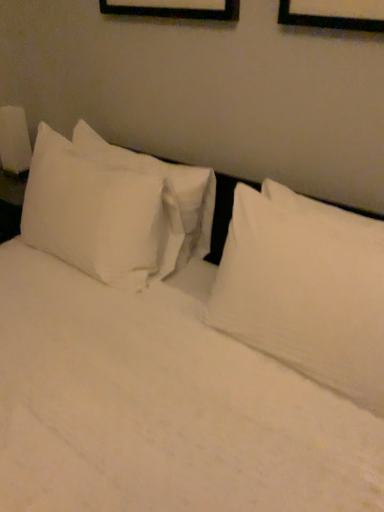
Where is `white soft pillow at upper right, which is the second pillow from left to right`? This screenshot has width=384, height=512. white soft pillow at upper right, which is the second pillow from left to right is located at coordinates (304, 295).

I want to click on white cotton pillow at left, placed as the second pillow when sorted from right to left, so click(x=100, y=215).

What do you see at coordinates (100, 215) in the screenshot?
I see `white cotton pillow at left, placed as the second pillow when sorted from right to left` at bounding box center [100, 215].

In order to click on white glossy lampshade at left in this screenshot , I will do `click(14, 140)`.

Considering the positions of objects white cotton pillow at left, which appears as the first pillow when viewed from the left, and white soft pillow at upper right, which is the second pillow from left to right, in the image provided, who is more to the left, white cotton pillow at left, which appears as the first pillow when viewed from the left, or white soft pillow at upper right, which is the second pillow from left to right,?

From the viewer's perspective, white cotton pillow at left, which appears as the first pillow when viewed from the left, appears more on the left side.

Can you confirm if white cotton pillow at left, which appears as the first pillow when viewed from the left, is bigger than white soft pillow at upper right, the 1th pillow positioned from the right?

Correct, white cotton pillow at left, which appears as the first pillow when viewed from the left, is larger in size than white soft pillow at upper right, the 1th pillow positioned from the right.

Considering the relative positions of white cotton pillow at left, which appears as the first pillow when viewed from the left, and white soft pillow at upper right, the 1th pillow positioned from the right, in the image provided, is white cotton pillow at left, which appears as the first pillow when viewed from the left, in front of white soft pillow at upper right, the 1th pillow positioned from the right,?

No, white cotton pillow at left, which appears as the first pillow when viewed from the left, is behind white soft pillow at upper right, the 1th pillow positioned from the right.

Does white glossy lampshade at left contain white cotton pillow at left, which appears as the first pillow when viewed from the left?

No.

From the image's perspective, which one is positioned lower, white glossy lampshade at left or white cotton pillow at left, placed as the second pillow when sorted from right to left?

white cotton pillow at left, placed as the second pillow when sorted from right to left, is shown below in the image.

Does white glossy lampshade at left turn towards white cotton pillow at left, which appears as the first pillow when viewed from the left?

No, white glossy lampshade at left does not turn towards white cotton pillow at left, which appears as the first pillow when viewed from the left.

From a real-world perspective, is white glossy lampshade at left positioned under white soft pillow at upper right, which is the second pillow from left to right, based on gravity?

Correct, in the physical world, white glossy lampshade at left is lower than white soft pillow at upper right, which is the second pillow from left to right.

Locate an element on the screen. The height and width of the screenshot is (512, 384). bedside lamp on the left side of white soft pillow at upper right, the 1th pillow positioned from the right is located at coordinates (14, 140).

Is white soft pillow at upper right, the 1th pillow positioned from the right, completely or partially inside white glossy lampshade at left?

No, white soft pillow at upper right, the 1th pillow positioned from the right, is not a part of white glossy lampshade at left.

From the image's perspective, between white cotton pillow at left, placed as the second pillow when sorted from right to left, and white glossy lampshade at left, who is located below?

white cotton pillow at left, placed as the second pillow when sorted from right to left, appears lower in the image.

Is white cotton pillow at left, placed as the second pillow when sorted from right to left, next to white glossy lampshade at left?

white cotton pillow at left, placed as the second pillow when sorted from right to left, and white glossy lampshade at left are not in contact.

At what (x,y) coordinates should I click in order to perform the action: click on pillow beneath the white glossy lampshade at left (from a real-world perspective). Please return your answer as a coordinate pair (x, y). Looking at the image, I should click on (100, 215).

Is white cotton pillow at left, placed as the second pillow when sorted from right to left, surrounding white glossy lampshade at left?

No, white cotton pillow at left, placed as the second pillow when sorted from right to left, does not contain white glossy lampshade at left.

Between point (343, 346) and point (9, 117), which one is positioned in front?

The point (343, 346) is more forward.

Which object is further away from the camera, white soft pillow at upper right, which is the second pillow from left to right, or white glossy lampshade at left?

white glossy lampshade at left is more distant.

Considering the relative sizes of white soft pillow at upper right, which is the second pillow from left to right, and white glossy lampshade at left in the image provided, is white soft pillow at upper right, which is the second pillow from left to right, smaller than white glossy lampshade at left?

Actually, white soft pillow at upper right, which is the second pillow from left to right, might be larger than white glossy lampshade at left.

Is white soft pillow at upper right, which is the second pillow from left to right, taller or shorter than white cotton pillow at left, placed as the second pillow when sorted from right to left?

white soft pillow at upper right, which is the second pillow from left to right, is shorter than white cotton pillow at left, placed as the second pillow when sorted from right to left.

From the image's perspective, is white soft pillow at upper right, the 1th pillow positioned from the right, on white cotton pillow at left, placed as the second pillow when sorted from right to left?

Incorrect, from the image's perspective, white soft pillow at upper right, the 1th pillow positioned from the right, is lower than white cotton pillow at left, placed as the second pillow when sorted from right to left.

From a real-world perspective, which is physically above, white soft pillow at upper right, the 1th pillow positioned from the right, or white cotton pillow at left, placed as the second pillow when sorted from right to left?

white soft pillow at upper right, the 1th pillow positioned from the right, is physically above.

Is white soft pillow at upper right, which is the second pillow from left to right, aimed at white cotton pillow at left, which appears as the first pillow when viewed from the left?

No, white soft pillow at upper right, which is the second pillow from left to right, is not turned towards white cotton pillow at left, which appears as the first pillow when viewed from the left.

The height and width of the screenshot is (512, 384). I want to click on pillow lying above the white soft pillow at upper right, which is the second pillow from left to right (from the image's perspective), so [100, 215].

The height and width of the screenshot is (512, 384). I want to click on bedside lamp that is behind the white cotton pillow at left, placed as the second pillow when sorted from right to left, so click(x=14, y=140).

Looking at the image, which one is located further to white soft pillow at upper right, which is the second pillow from left to right, white cotton pillow at left, placed as the second pillow when sorted from right to left, or white glossy lampshade at left?

The object further to white soft pillow at upper right, which is the second pillow from left to right, is white glossy lampshade at left.

In the scene shown: Considering their positions, is white cotton pillow at left, which appears as the first pillow when viewed from the left, positioned further to white glossy lampshade at left than white soft pillow at upper right, the 1th pillow positioned from the right?

The object further to white glossy lampshade at left is white soft pillow at upper right, the 1th pillow positioned from the right.

Estimate the real-world distances between objects in this image. Which object is further from white glossy lampshade at left, white soft pillow at upper right, which is the second pillow from left to right, or white cotton pillow at left, placed as the second pillow when sorted from right to left?

Based on the image, white soft pillow at upper right, which is the second pillow from left to right, appears to be further to white glossy lampshade at left.

Which object lies further to the anchor point white soft pillow at upper right, the 1th pillow positioned from the right, white glossy lampshade at left or white cotton pillow at left, placed as the second pillow when sorted from right to left?

white glossy lampshade at left is further to white soft pillow at upper right, the 1th pillow positioned from the right.

Based on their spatial positions, is white soft pillow at upper right, which is the second pillow from left to right, or white glossy lampshade at left closer to white cotton pillow at left, which appears as the first pillow when viewed from the left?

Among the two, white soft pillow at upper right, which is the second pillow from left to right, is located nearer to white cotton pillow at left, which appears as the first pillow when viewed from the left.

When comparing their distances from white cotton pillow at left, which appears as the first pillow when viewed from the left, does white glossy lampshade at left or white soft pillow at upper right, which is the second pillow from left to right, seem further?

white glossy lampshade at left is positioned further to the anchor white cotton pillow at left, which appears as the first pillow when viewed from the left.

Where is `pillow situated between white glossy lampshade at left and white soft pillow at upper right, the 1th pillow positioned from the right, from left to right`? The width and height of the screenshot is (384, 512). pillow situated between white glossy lampshade at left and white soft pillow at upper right, the 1th pillow positioned from the right, from left to right is located at coordinates (100, 215).